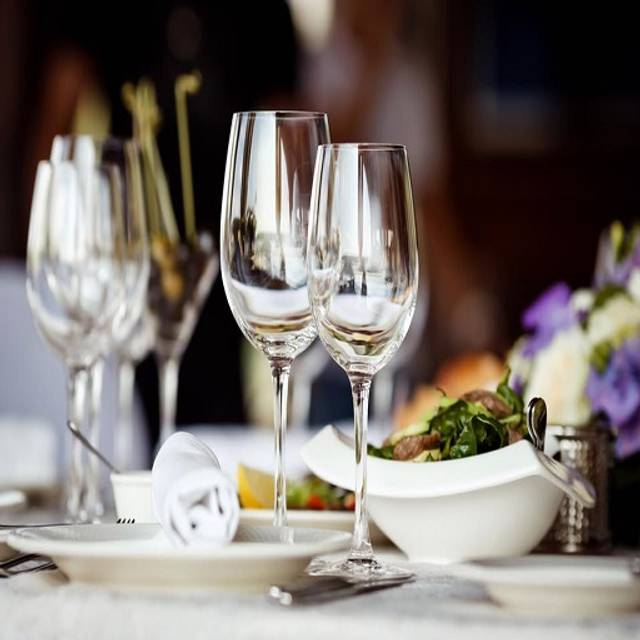
I want to click on glass, so click(x=358, y=502).